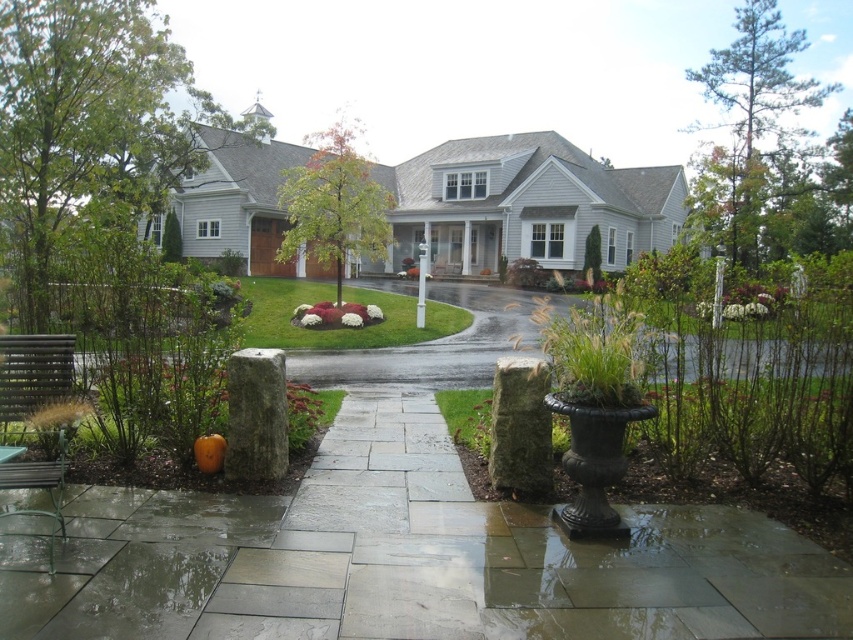
Consider the image. You are standing at the front door of the house and want to place a new decorative item exactly at the point marked by the coordinates (520, 428). What object is located at that point?

The point at coordinates (520, 428) marks the location of the green mossy stone pillar at center.